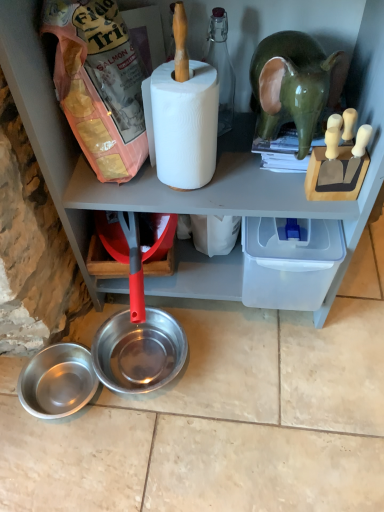
Identify the location of empty space that is in between brushed metal bowl at lower left, which appears as the 2th bowl when viewed from the right, and shiny metallic bowl at lower center, the 1th bowl when ordered from right to left. This screenshot has width=384, height=512. (119, 392).